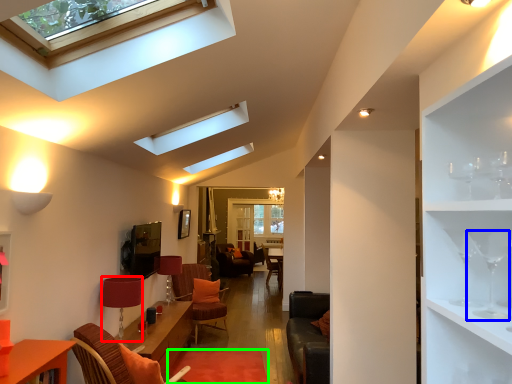
Question: Which object is positioned closest to lamp (highlighted by a red box)? Select from wine glass (highlighted by a blue box) and plain (highlighted by a green box).

Choices:
 (A) wine glass
 (B) plain

Answer: (B)